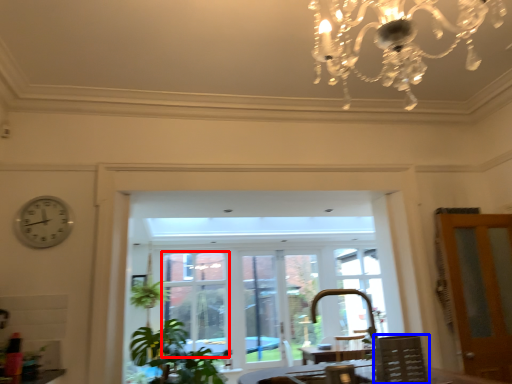
Question: Which object is closer to the camera taking this photo, window (highlighted by a red box) or chair (highlighted by a blue box)?

Choices:
 (A) window
 (B) chair

Answer: (B)